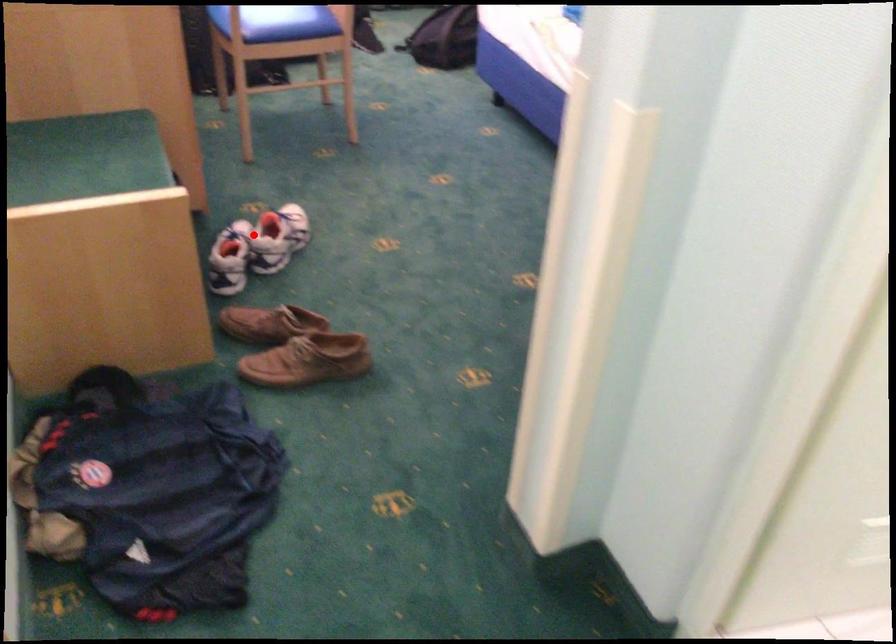
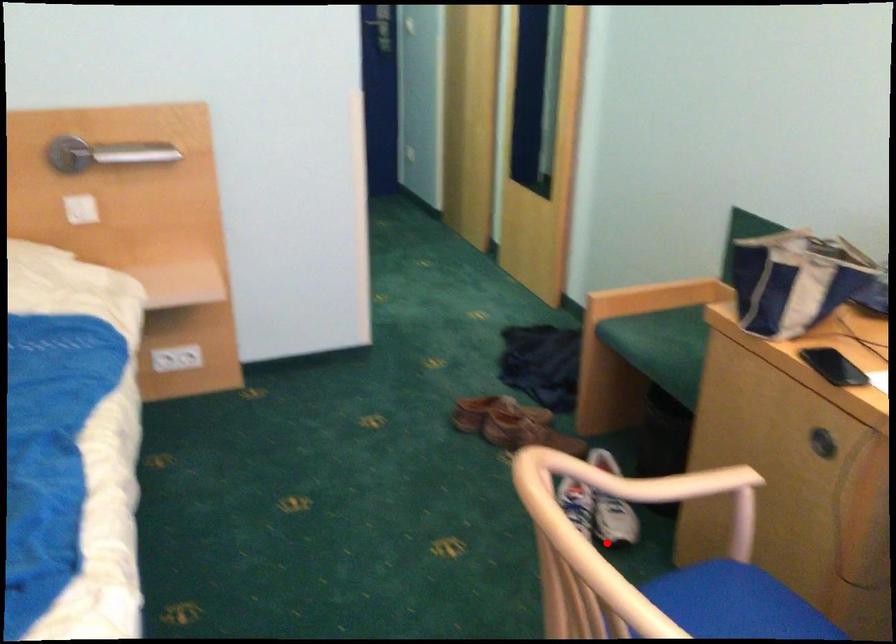
I am providing you with two images of the same scene from different viewpoints. A red point is marked on the first image and another point is marked on the second image. Does the point marked in image1 correspond to the same location as the one in image2?

Yes